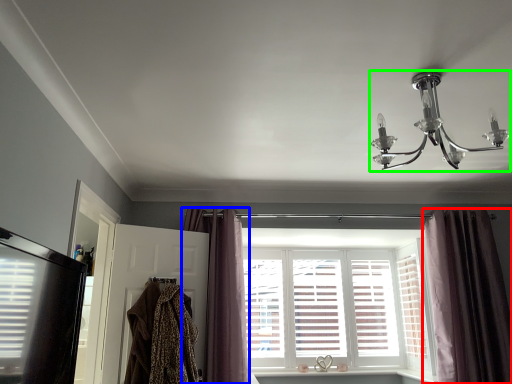
Question: Which object is the farthest from curtain (highlighted by a red box)? Choose among these: curtain (highlighted by a blue box) or lamp (highlighted by a green box).

Choices:
 (A) curtain
 (B) lamp

Answer: (A)